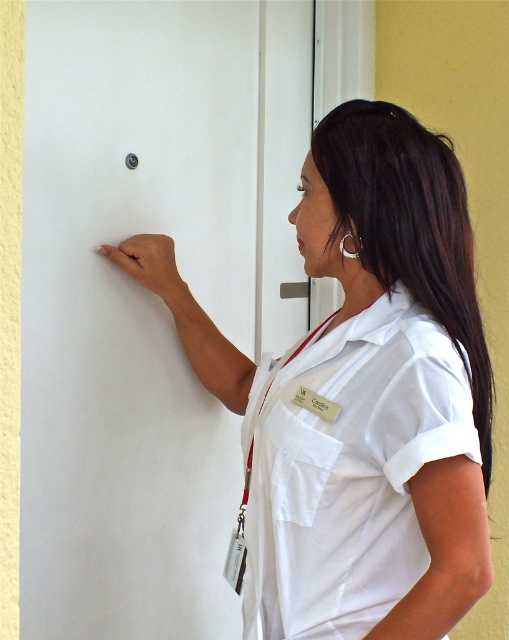
You are a visitor at a hotel and need to open the door. You see a metallic silver door handle at center and a satin silver door handle at upper center. Which one should you use to open the door?

The metallic silver door handle at center is bigger than the satin silver door handle at upper center, so you should use the metallic silver door handle at center to open the door.